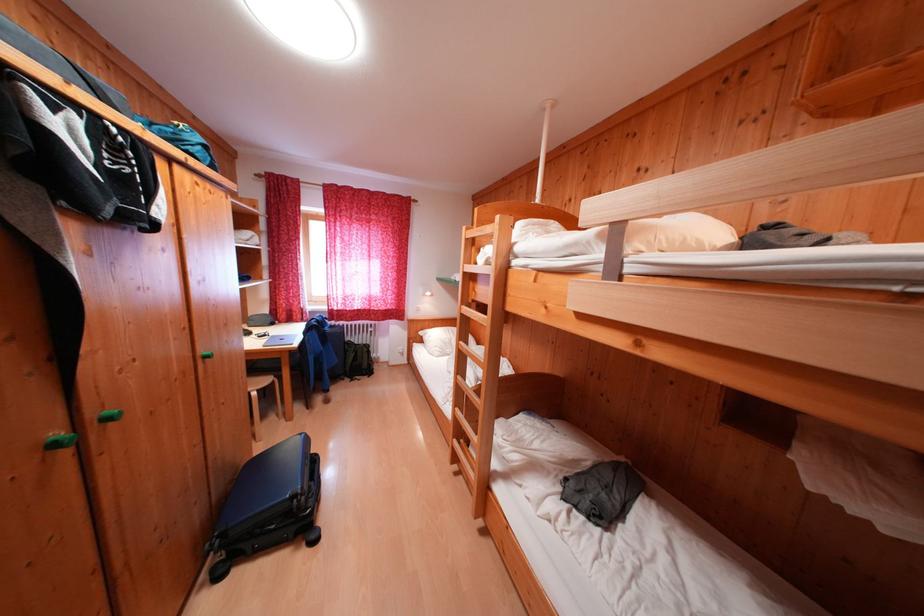
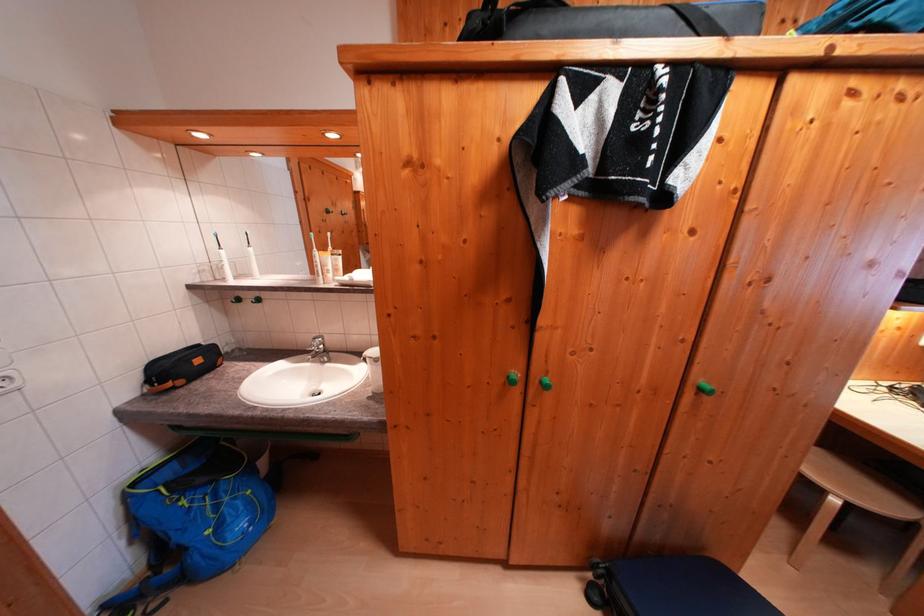
Where in the second image is the point corresponding to point 214,362 from the first image?

(709, 394)